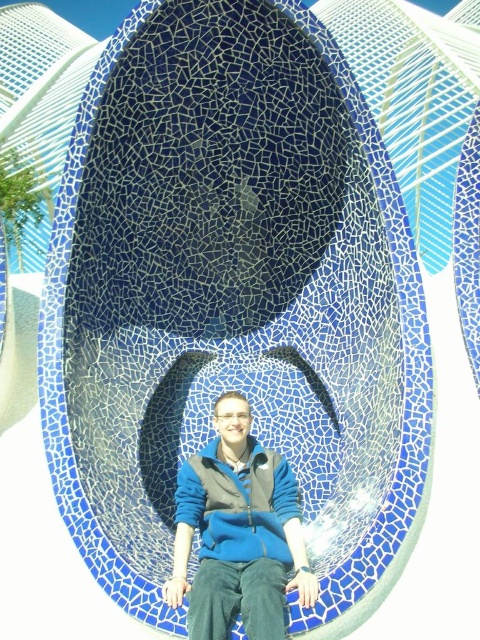
You are organizing a clothing donation drive and need to arrange items in order from left to right. You have a blue matte sweater at center and a blue fleece sweatshirt at center. According to the image, which item should be placed first on the left side?

The blue fleece sweatshirt at center should be placed first on the left side because the blue matte sweater at center is to the right of it in the image.

You are organizing a clothing rack and need to arrange the blue matte sweater at center and blue fleece sweatshirt at center vertically. Which item should you place higher up to accommodate their sizes?

The blue matte sweater at center is much taller than the blue fleece sweatshirt at center, so you should place the blue matte sweater at center higher up to account for its greater height.